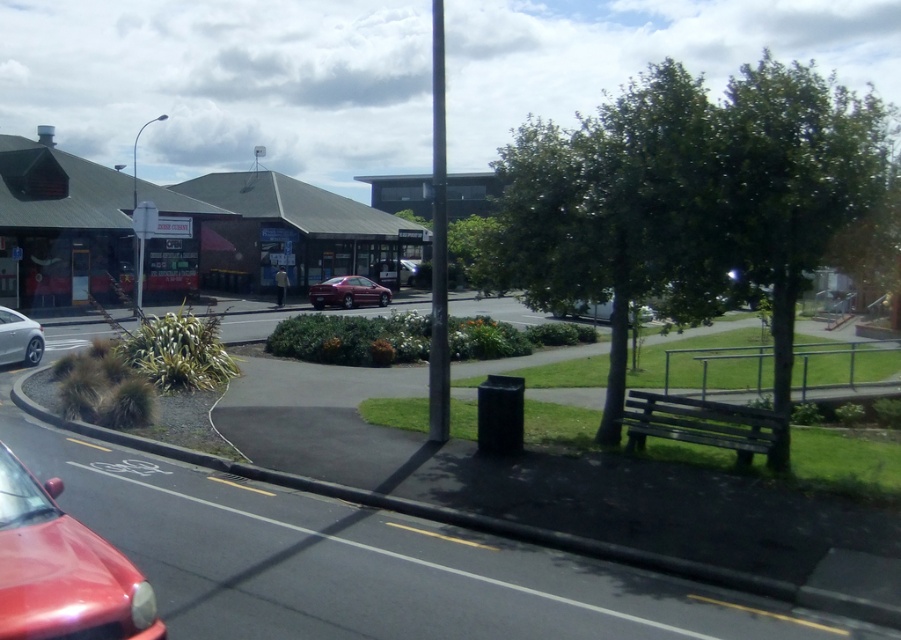
You are a pedestrian standing on the sidewalk near the trash bin. You want to cross the road to reach the building complex. Which car, the silver metallic sedan at left or the shiny red car at center, is closer to your current position?

The silver metallic sedan at left is closer to your current position because it is positioned to the left of the shiny red car at center, and you are standing near the trash bin on the sidewalk which is located to the left side of the road.

You are a pedestrian crossing the street and see the silver metallic sedan at left and the shiny red car at center. Which car is closer to you?

The silver metallic sedan at left is closer to you because it is in front of the shiny red car at center.

You are taking a photo of the urban street scene described. You notice two points marked at coordinates point (344, 278) and point (412, 260) in the image. Which point appears closer to your camera lens when capturing the scene?

Point (344, 278) is closer to the camera than point (412, 260).